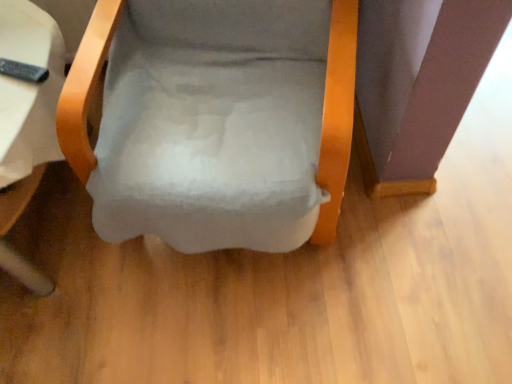
Locate an element on the screen. The image size is (512, 384). vacant area that is situated to the right of suede-like gray chair at center is located at coordinates (435, 214).